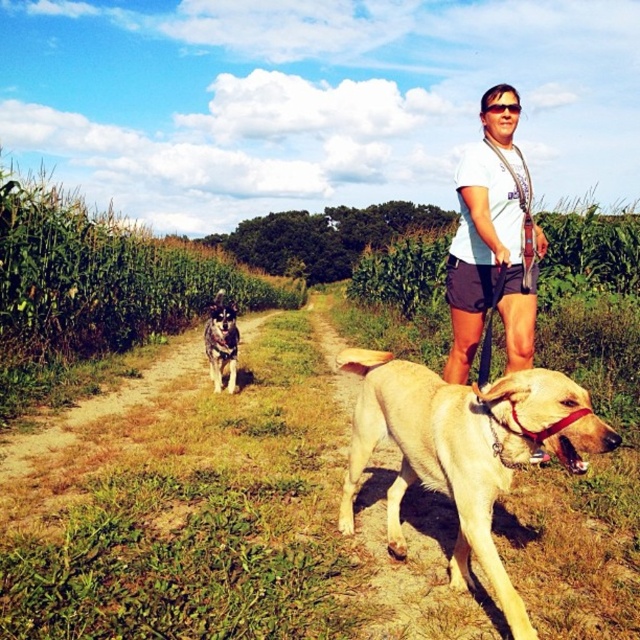
Is point (500, 444) positioned after point (512, 355)?

No, it is not.

Which is behind, point (397, 525) or point (468, 292)?

The point (468, 292) is behind.

This screenshot has width=640, height=640. Identify the location of golden fur dog at center. (465, 451).

You are a GUI agent. You are given a task and a screenshot of the screen. Output one action in this format:
    pyautogui.click(x=<x>, y=<y>)
    Task: Click on the golden fur dog at center
    This screenshot has height=640, width=640.
    Given the screenshot: What is the action you would take?
    pyautogui.click(x=465, y=451)

Can you confirm if white t-shirt at center is positioned above gray fur dog at left?

No.

Does point (509, 352) lie behind point (228, 339)?

No.

Find the location of a particular element. The height and width of the screenshot is (640, 640). white t-shirt at center is located at coordinates (490, 250).

Measure the distance between golden fur dog at center and camera.

The distance of golden fur dog at center from camera is 5.92 feet.

Identify the location of golden fur dog at center. Image resolution: width=640 pixels, height=640 pixels. (465, 451).